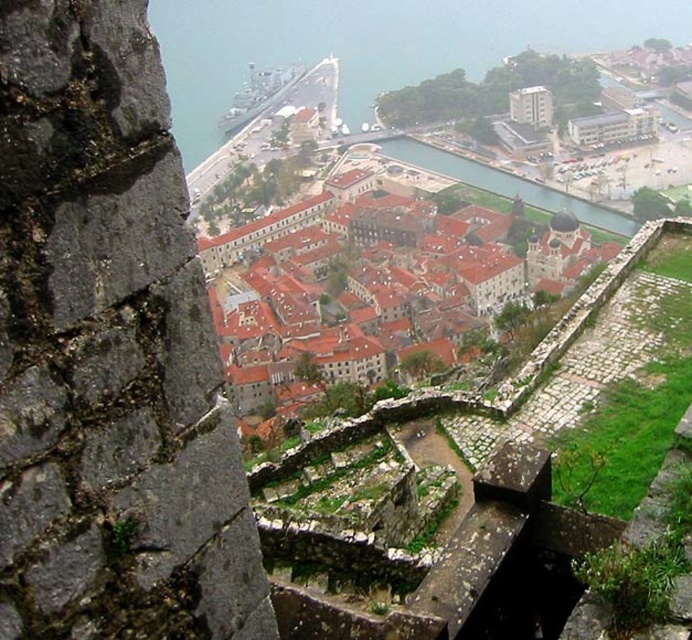
You are an architect planning to install solar panels on the brown tiled roofs at center and the clear water at center in the historic town. Considering their sizes, which location would allow for more solar panels to be installed?

The brown tiled roofs at center is larger in size than clear water at center, so more solar panels can be installed on the brown tiled roofs at center.